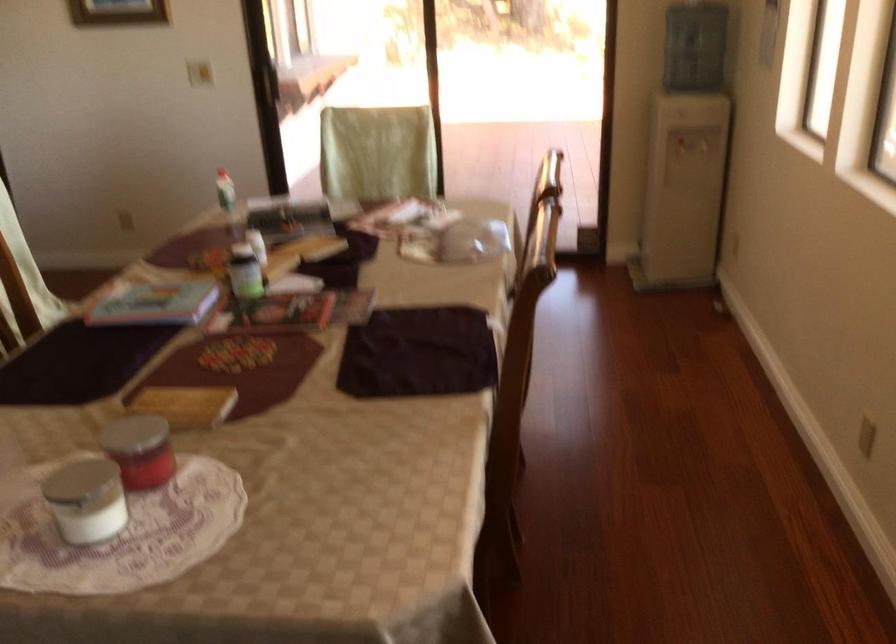
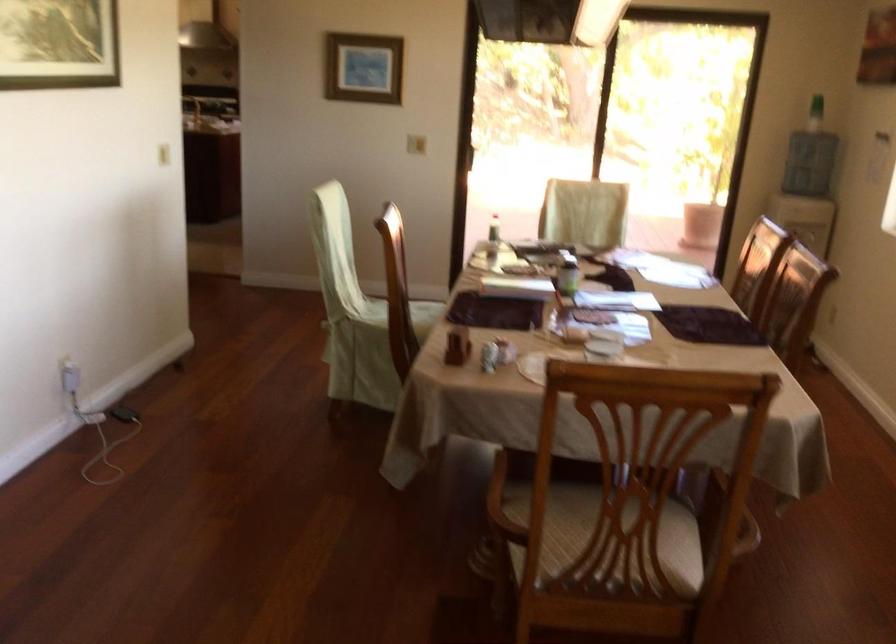
In the second image, find the point that corresponds to [229,278] in the first image.

(566, 272)